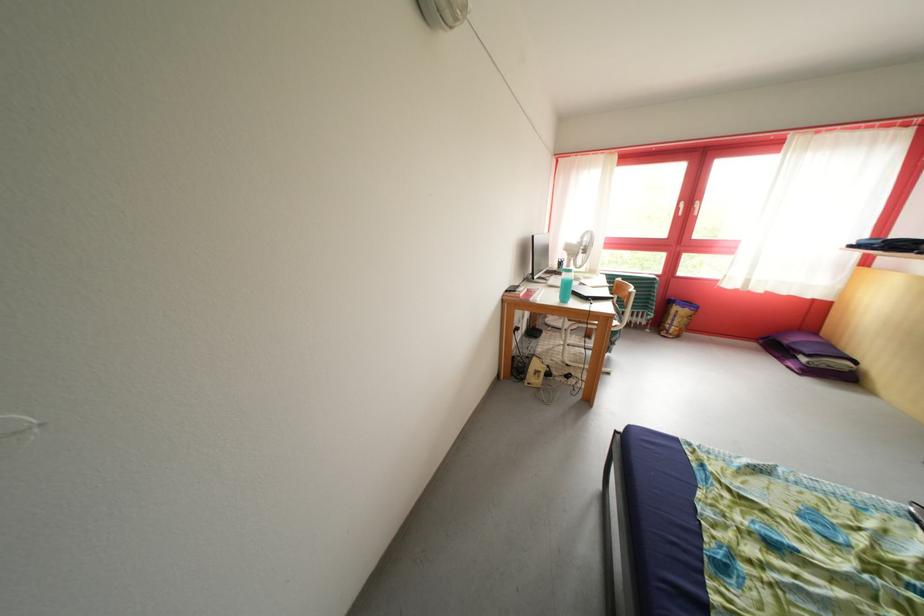
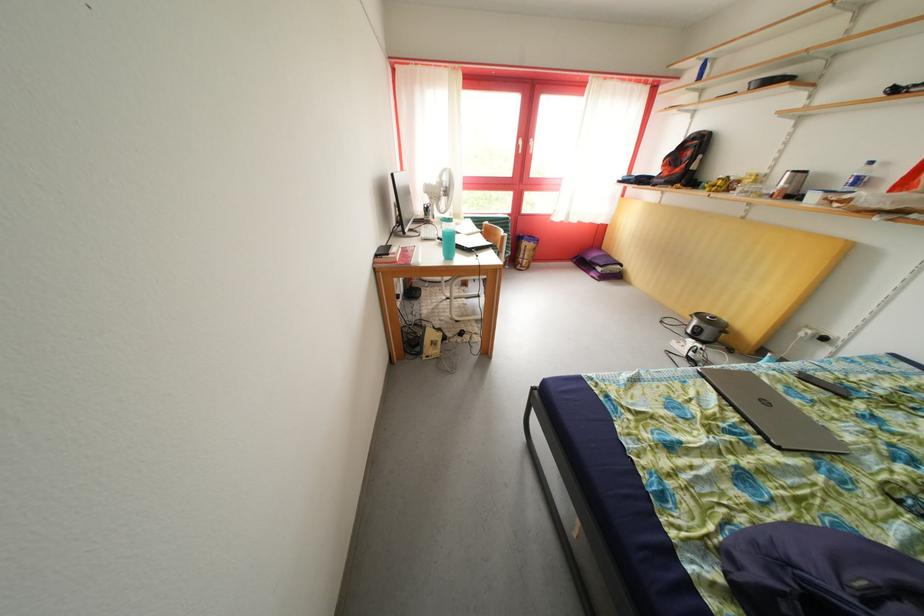
Question: I am providing you with two images of the same scene from different viewpoints. After the viewpoint changes to image2, which objects are now occluded?

Choices:
 (A) white desk fan
 (B) grey laptop computer
 (C) small rice cooker
 (D) none of these

Answer: (D)